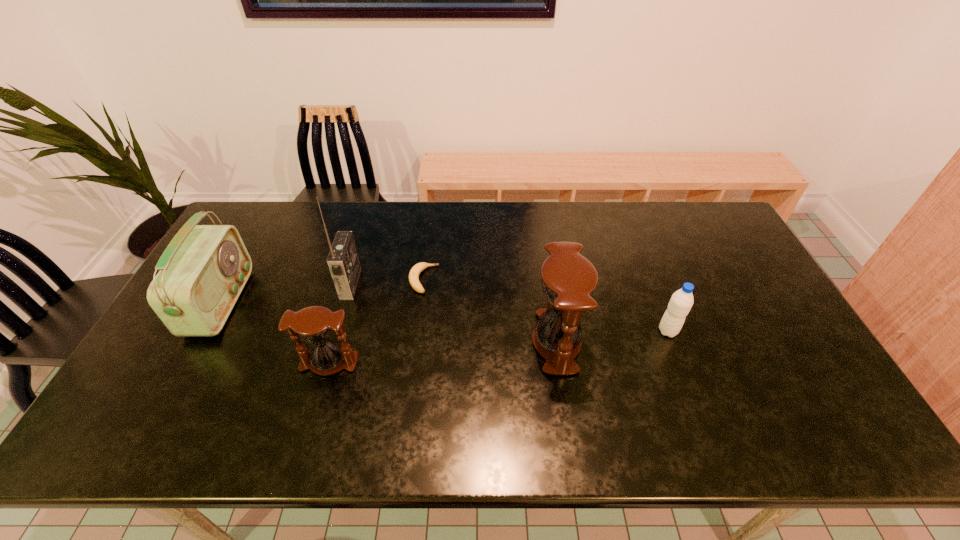
What are the coordinates of `vacant space located 0.310m on the back of the shorter hourglass` in the screenshot? It's located at (356, 269).

Where is `free point located on the back of the right hourglass`? free point located on the back of the right hourglass is located at coordinates (544, 264).

At what (x,y) coordinates should I click in order to perform the action: click on free space located on the front of the shortest object. Please return your answer as a coordinate pair (x, y). Looking at the image, I should click on (410, 389).

This screenshot has width=960, height=540. I want to click on vacant space located on the front panel of the left radio receiver, so [x=351, y=302].

You are a GUI agent. You are given a task and a screenshot of the screen. Output one action in this format:
    pyautogui.click(x=<x>, y=<y>)
    Task: Click on the blank space located on the right of the water bottle
    
    Given the screenshot: What is the action you would take?
    pyautogui.click(x=735, y=331)

Where is `free region located 0.270m on the display of the right radio receiver`? free region located 0.270m on the display of the right radio receiver is located at coordinates (446, 284).

The height and width of the screenshot is (540, 960). In order to click on object at the left edge in this screenshot , I will do `click(203, 270)`.

Locate an element on the screen. Image resolution: width=960 pixels, height=540 pixels. free space at the far edge of the desktop is located at coordinates (621, 206).

I want to click on free space at the right edge, so click(x=696, y=246).

At what (x,y) coordinates should I click in order to perform the action: click on free space at the far right corner of the desktop. Please return your answer as a coordinate pair (x, y). Image resolution: width=960 pixels, height=540 pixels. Looking at the image, I should click on (708, 239).